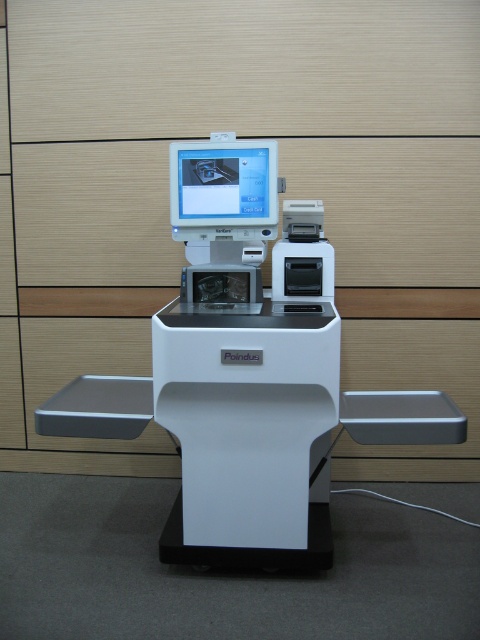
Question: Which object appears closest to the camera in this image?

Choices:
 (A) matte plastic monitor at center
 (B) white plastic machine at center

Answer: (B)

Question: Does white plastic machine at center have a larger size compared to matte plastic monitor at center?

Choices:
 (A) no
 (B) yes

Answer: (B)

Question: Is the position of white plastic machine at center more distant than that of matte plastic monitor at center?

Choices:
 (A) no
 (B) yes

Answer: (A)

Question: Does white plastic machine at center appear on the left side of matte plastic monitor at center?

Choices:
 (A) no
 (B) yes

Answer: (A)

Question: Which point is closer to the camera?

Choices:
 (A) matte plastic monitor at center
 (B) white plastic machine at center

Answer: (B)